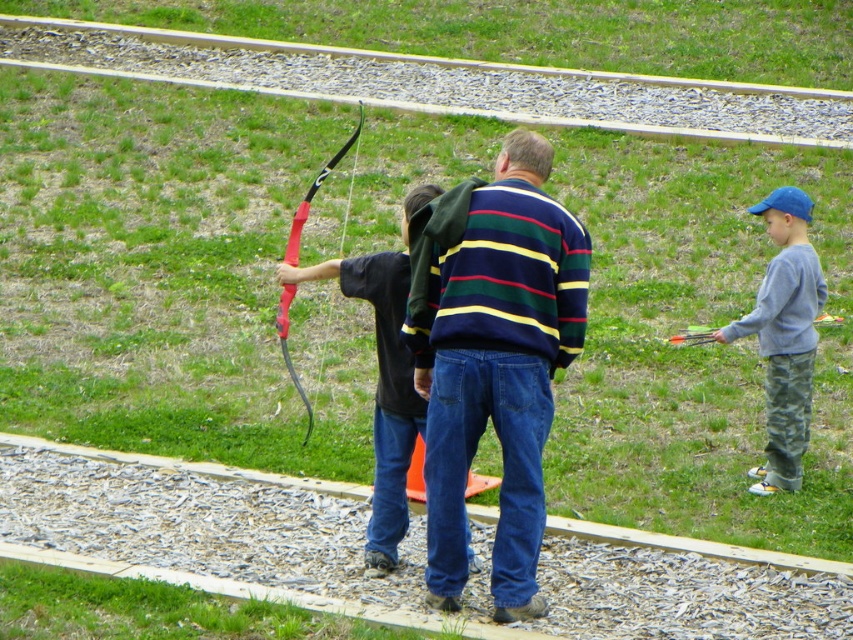
Who is lower down, striped sweater at center or gray cotton sweatshirt at right?

striped sweater at center

Is striped sweater at center bigger than gray cotton sweatshirt at right?

Indeed, striped sweater at center has a larger size compared to gray cotton sweatshirt at right.

Find the location of a particular element. This screenshot has height=640, width=853. striped sweater at center is located at coordinates (492, 356).

Who is more forward, (x=776, y=480) or (x=287, y=332)?

Point (x=287, y=332) is more forward.

Looking at this image, does gray cotton sweatshirt at right have a smaller size compared to rubberized red bow at center?

Yes.

What do you see at coordinates (784, 337) in the screenshot? I see `gray cotton sweatshirt at right` at bounding box center [784, 337].

Locate an element on the screen. The height and width of the screenshot is (640, 853). gray cotton sweatshirt at right is located at coordinates (784, 337).

Does striped sweater at center have a lesser height compared to rubberized red bow at center?

Correct, striped sweater at center is not as tall as rubberized red bow at center.

Between point (506, 460) and point (296, 212), which one is positioned in front?

Positioned in front is point (506, 460).

Find the location of a particular element. striped sweater at center is located at coordinates (492, 356).